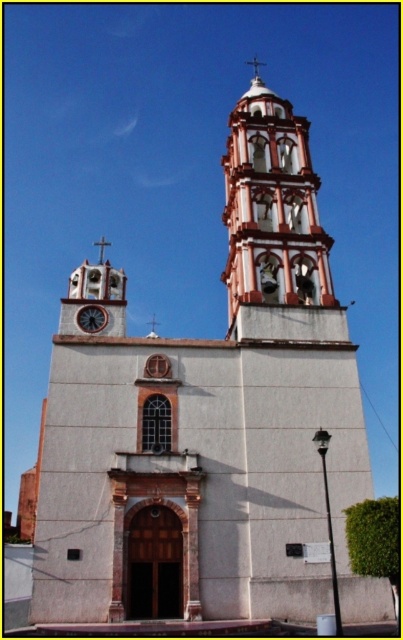
Question: Where is wooden clock at center located in relation to white stucco spire at upper center in the image?

Choices:
 (A) left
 (B) right

Answer: (A)

Question: Can you confirm if white painted brick tower at upper center is positioned to the left of white stucco spire at upper center?

Choices:
 (A) yes
 (B) no

Answer: (A)

Question: Among these points, which one is farthest from the camera?

Choices:
 (A) (301, 252)
 (B) (257, 68)
 (C) (91, 324)

Answer: (B)

Question: Which object is closer to the camera taking this photo?

Choices:
 (A) wooden clock at center
 (B) white stucco spire at upper center

Answer: (A)

Question: Which point is closer to the camera?

Choices:
 (A) (278, 177)
 (B) (255, 70)
 (C) (91, 326)

Answer: (C)

Question: Can you confirm if white painted brick tower at upper center is thinner than wooden clock at center?

Choices:
 (A) yes
 (B) no

Answer: (B)